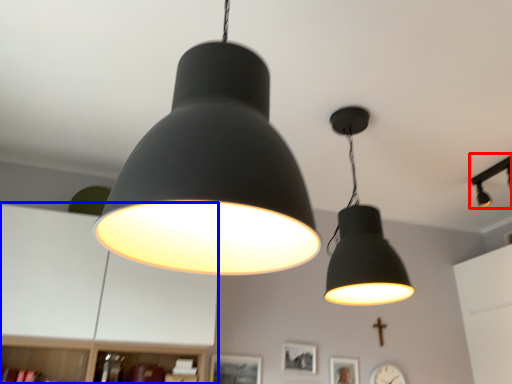
Question: Which object appears farthest to the camera in this image, lamp (highlighted by a red box) or dresser (highlighted by a blue box)?

Choices:
 (A) lamp
 (B) dresser

Answer: (A)